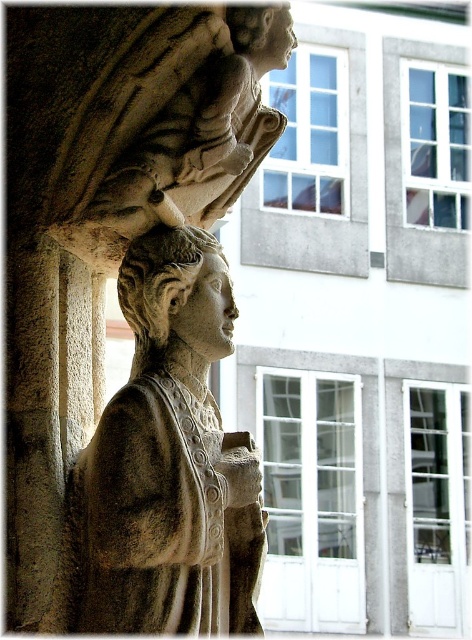
Question: Is gray stone head at center to the left of smooth stone head at upper center from the viewer's perspective?

Choices:
 (A) yes
 (B) no

Answer: (A)

Question: Which object is farther from the camera taking this photo?

Choices:
 (A) gray stone head at center
 (B) gray stone statue at center
 (C) smooth stone head at upper center

Answer: (C)

Question: Can you confirm if gray stone head at center is smaller than smooth stone head at upper center?

Choices:
 (A) yes
 (B) no

Answer: (B)

Question: Which point is farther to the camera?

Choices:
 (A) (160, 628)
 (B) (263, 72)

Answer: (B)

Question: Can you confirm if gray stone head at center is positioned above smooth stone head at upper center?

Choices:
 (A) no
 (B) yes

Answer: (A)

Question: Which object is positioned farthest from the smooth stone head at upper center?

Choices:
 (A) gray stone statue at center
 (B) gray stone head at center

Answer: (A)